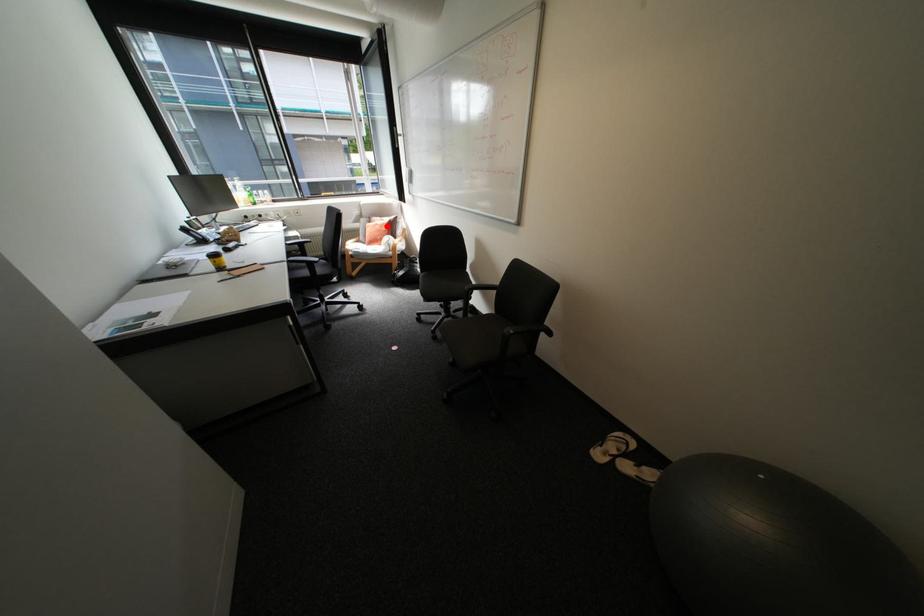
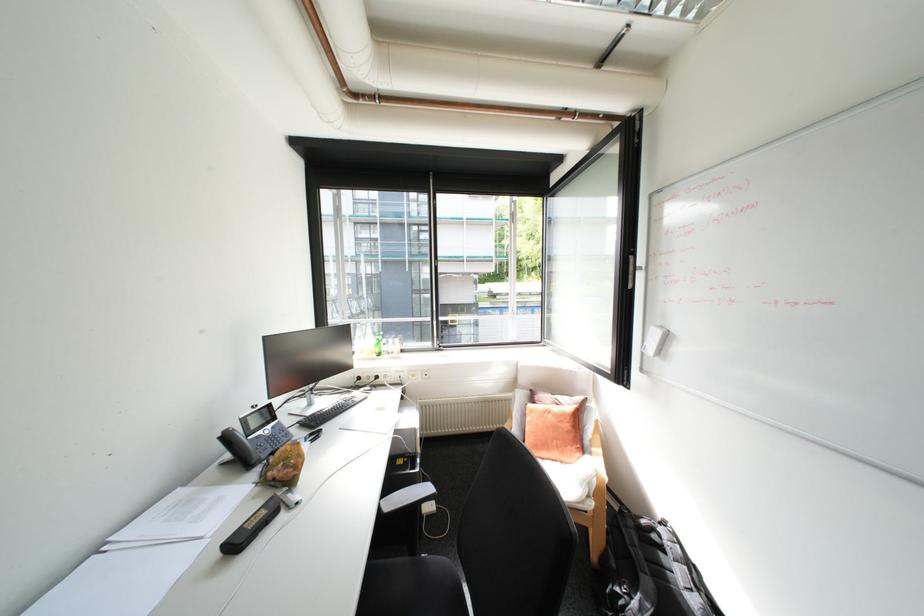
Question: I am providing you with two images of the same scene from different viewpoints. Image1 has a red point marked. In image2, the corresponding 3D location appears at what relative position? Reply with the corresponding letter.

Choices:
 (A) Closer
 (B) Farther

Answer: (B)